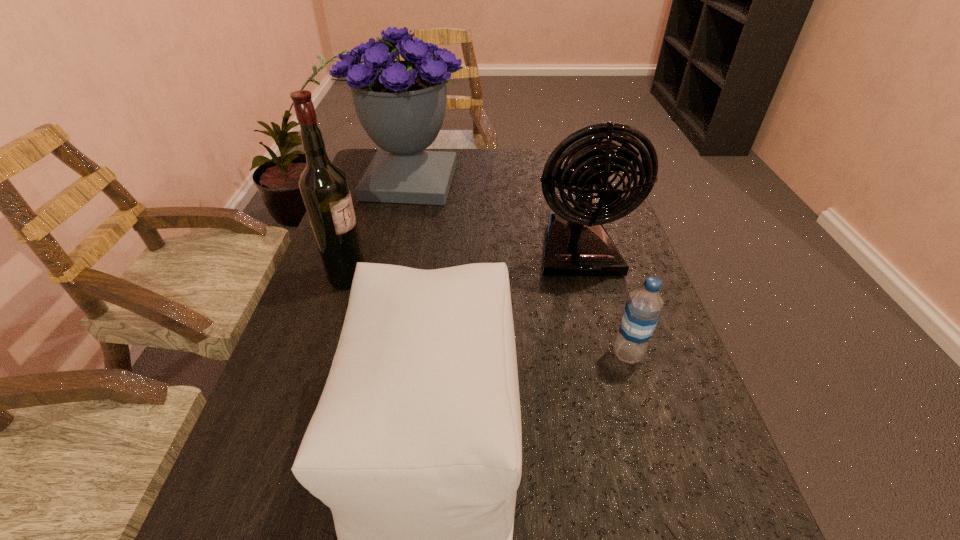
You are a GUI agent. You are given a task and a screenshot of the screen. Output one action in this format:
    pyautogui.click(x=<x>, y=<y>)
    Task: Click on the blank region between the water bottle and the fan
    
    Given the screenshot: What is the action you would take?
    pyautogui.click(x=603, y=302)

This screenshot has width=960, height=540. Find the location of `unoccupied position between the bouquet and the water bottle`. unoccupied position between the bouquet and the water bottle is located at coordinates (519, 268).

In order to click on free spot between the bouquet and the wine bottle in this screenshot , I will do `click(379, 229)`.

Choose which object is the nearest neighbor to the bouquet. Please provide its 2D coordinates. Your answer should be formatted as a tuple, i.e. [(x, y)], where the tuple contains the x and y coordinates of a point satisfying the conditions above.

[(577, 244)]

At what (x,y) coordinates should I click in order to perform the action: click on the second closest object to the water bottle. Please return your answer as a coordinate pair (x, y). This screenshot has width=960, height=540. Looking at the image, I should click on (415, 445).

This screenshot has height=540, width=960. I want to click on vacant space that satisfies the following two spatial constraints: 1. in front of the fan to blow air; 2. on the front and back of the wine bottle, so click(585, 277).

What are the coordinates of `vacant space that satisfies the following two spatial constraints: 1. in front of the fan to blow air; 2. on the front and back of the wine bottle` in the screenshot? It's located at (585, 277).